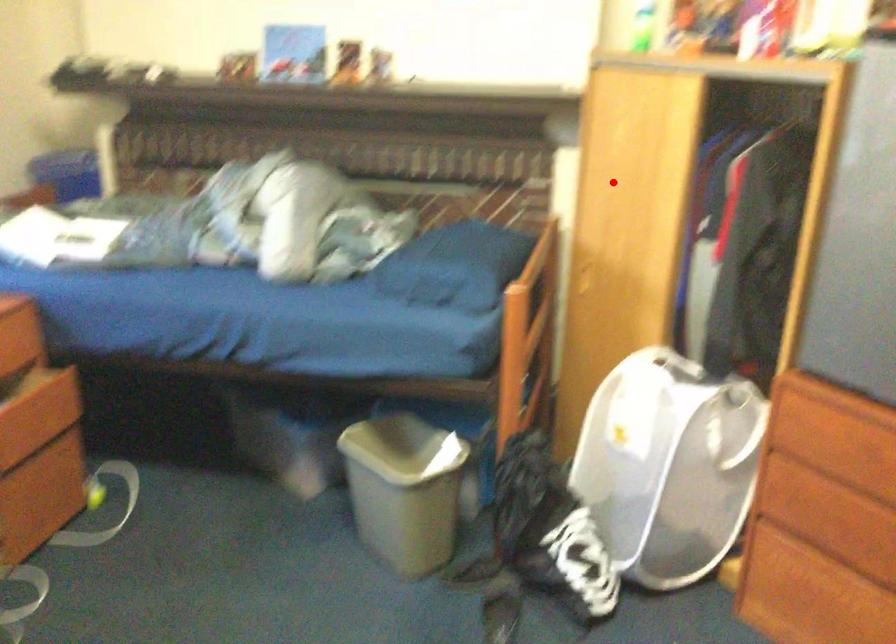
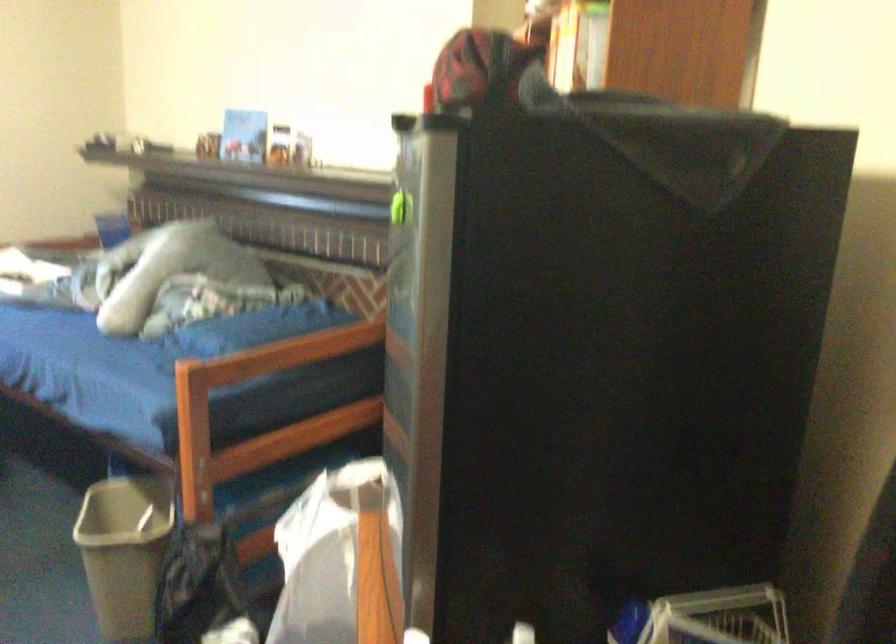
Question: I am providing you with two images of the same scene from different viewpoints. A red point is marked on the first image. Is the red point's position out of view in image 2?

Choices:
 (A) Yes
 (B) No

Answer: (A)